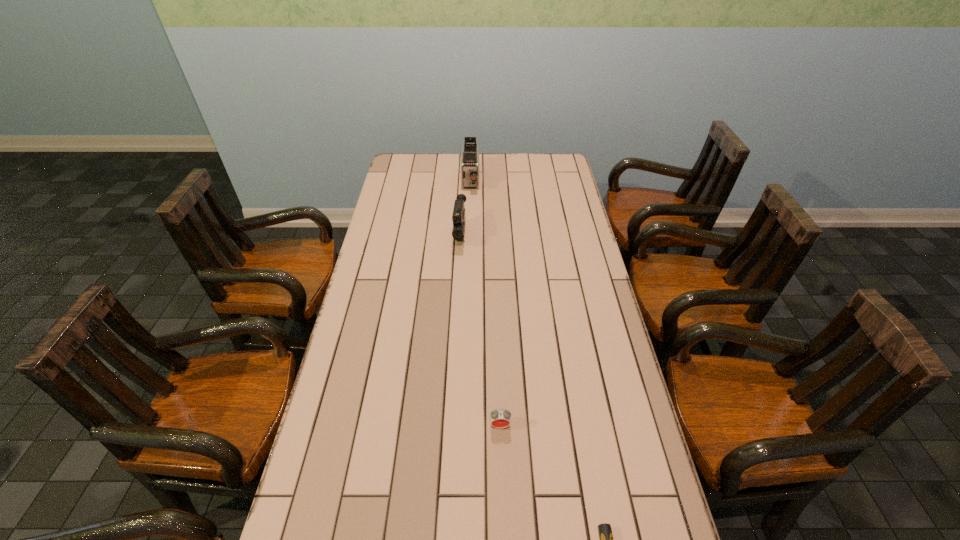
Where is `the farthest object`? The height and width of the screenshot is (540, 960). the farthest object is located at coordinates (470, 150).

I want to click on the farther camcorder, so click(470, 150).

The width and height of the screenshot is (960, 540). Find the location of `the nearer camcorder`. the nearer camcorder is located at coordinates (458, 217).

The image size is (960, 540). Find the location of `the shorter camcorder`. the shorter camcorder is located at coordinates (458, 217).

The height and width of the screenshot is (540, 960). I want to click on the second nearest object, so click(x=500, y=418).

I want to click on the third object from left to right, so click(500, 418).

Image resolution: width=960 pixels, height=540 pixels. What are the coordinates of `blank space located 0.310m at the lens of the taller camcorder` in the screenshot? It's located at (468, 239).

This screenshot has height=540, width=960. I want to click on free spot located 0.310m on the front-facing side of the shorter camcorder, so click(456, 314).

Identify the location of vacant space situated on the face of the second object from right to left. The height and width of the screenshot is (540, 960). (501, 449).

Find the location of `object that is at the far edge`. object that is at the far edge is located at coordinates (470, 150).